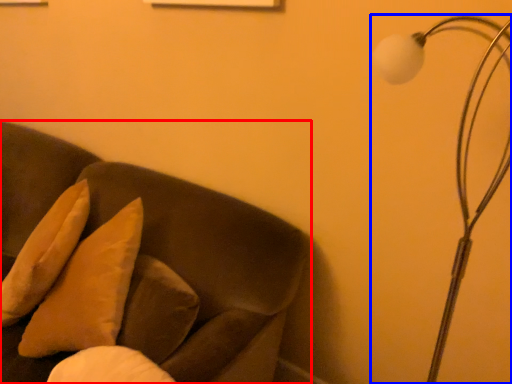
Question: Which point is further to the camera, furniture (highlighted by a red box) or lamp (highlighted by a blue box)?

Choices:
 (A) furniture
 (B) lamp

Answer: (A)